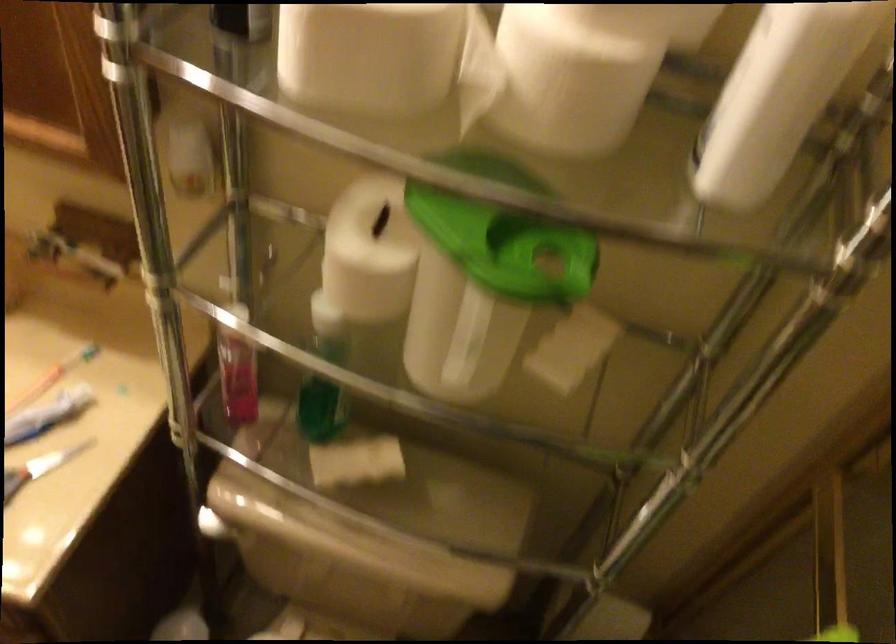
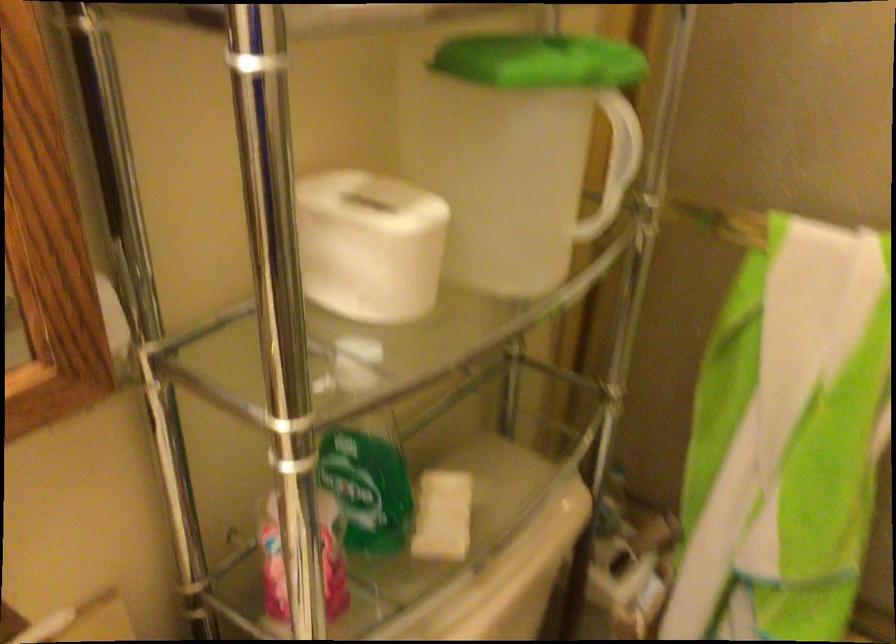
Find the pixel in the second image that matches (x=442, y=210) in the first image.

(539, 61)